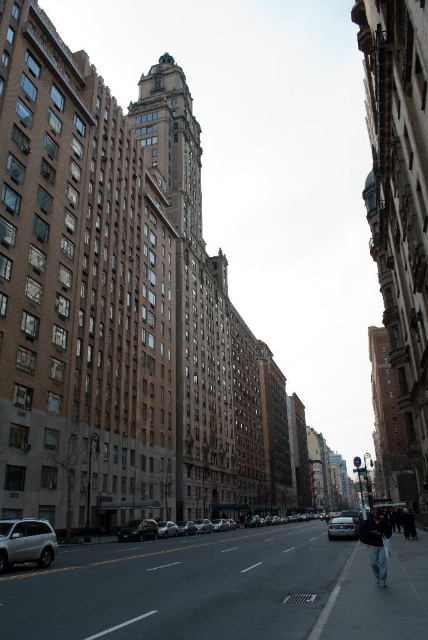
You are a delivery driver who needs to park your shiny silver car at center. The parking spot is at point (137, 531). Can you safely park there?

The point (137, 531) marks the shiny silver car at center, so you cannot park there as the spot is already occupied by the shiny silver car at center.

You are a pedestrian standing on the street and see the dark blue jeans at lower right and the shiny silver car at center. Which object is taller?

The dark blue jeans at lower right is taller than the shiny silver car at center.

You are a pedestrian standing on the sidewalk and want to cross the street to reach the shiny silver sedan at center. Is the shiny silver car at center blocking your path?

The shiny silver car at center is closer to the viewer than the shiny silver sedan at center, so it is blocking the path to the shiny silver sedan at center.